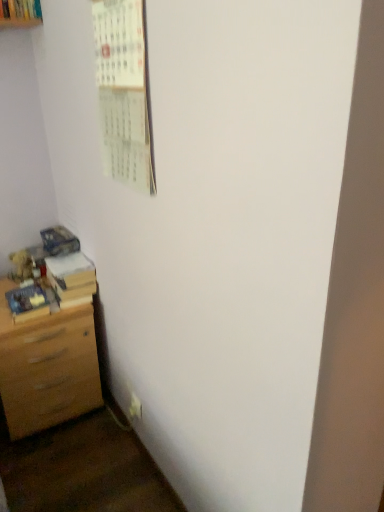
Question: Is light brown wood chest of drawers at lower left positioned with its back to wooden book at lower left, the second book viewed from the front?

Choices:
 (A) yes
 (B) no

Answer: (B)

Question: Is light brown wood chest of drawers at lower left shorter than wooden book at lower left, the second book viewed from the front?

Choices:
 (A) no
 (B) yes

Answer: (A)

Question: Does light brown wood chest of drawers at lower left have a lesser width compared to wooden book at lower left, which is counted as the 1th book, starting from the back?

Choices:
 (A) no
 (B) yes

Answer: (A)

Question: From a real-world perspective, is light brown wood chest of drawers at lower left over wooden book at lower left, which is counted as the 1th book, starting from the back?

Choices:
 (A) no
 (B) yes

Answer: (A)

Question: Does light brown wood chest of drawers at lower left appear on the left side of wooden book at lower left, the second book viewed from the front?

Choices:
 (A) no
 (B) yes

Answer: (B)

Question: Is light brown wood chest of drawers at lower left to the left or to the right of wooden book at lower left, which is counted as the 1th book, starting from the back, in the image?

Choices:
 (A) right
 (B) left

Answer: (B)

Question: Looking at their shapes, would you say light brown wood chest of drawers at lower left is wider or thinner than wooden book at lower left, the second book viewed from the front?

Choices:
 (A) wide
 (B) thin

Answer: (A)

Question: In terms of height, does light brown wood chest of drawers at lower left look taller or shorter compared to wooden book at lower left, which is counted as the 1th book, starting from the back?

Choices:
 (A) short
 (B) tall

Answer: (B)

Question: From a real-world perspective, is light brown wood chest of drawers at lower left positioned above or below wooden book at lower left, the second book viewed from the front?

Choices:
 (A) above
 (B) below

Answer: (B)

Question: Is light brown wood chest of drawers at lower left to the left or to the right of matte blue book at lower left, which appears as the first book when viewed from the front, in the image?

Choices:
 (A) left
 (B) right

Answer: (A)

Question: Is light brown wood chest of drawers at lower left taller or shorter than matte blue book at lower left, which appears as the first book when viewed from the front?

Choices:
 (A) short
 (B) tall

Answer: (B)

Question: Considering the positions of light brown wood chest of drawers at lower left and matte blue book at lower left, which appears as the first book when viewed from the front, in the image, is light brown wood chest of drawers at lower left wider or thinner than matte blue book at lower left, which appears as the first book when viewed from the front,?

Choices:
 (A) wide
 (B) thin

Answer: (A)

Question: Considering the positions of light brown wood chest of drawers at lower left and matte blue book at lower left, which appears as the first book when viewed from the front, in the image, is light brown wood chest of drawers at lower left bigger or smaller than matte blue book at lower left, which appears as the first book when viewed from the front,?

Choices:
 (A) small
 (B) big

Answer: (B)

Question: In terms of width, does white paper calendar at upper left look wider or thinner when compared to white plastic electric outlet at lower left?

Choices:
 (A) wide
 (B) thin

Answer: (A)

Question: Is white paper calendar at upper left inside the boundaries of white plastic electric outlet at lower left, or outside?

Choices:
 (A) outside
 (B) inside

Answer: (A)